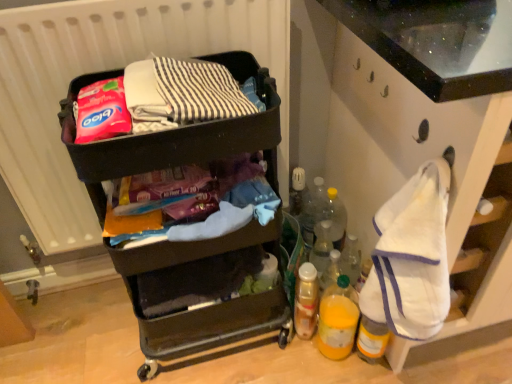
Where is `free space to the left of black plastic cart at upper left`? The height and width of the screenshot is (384, 512). free space to the left of black plastic cart at upper left is located at coordinates (92, 340).